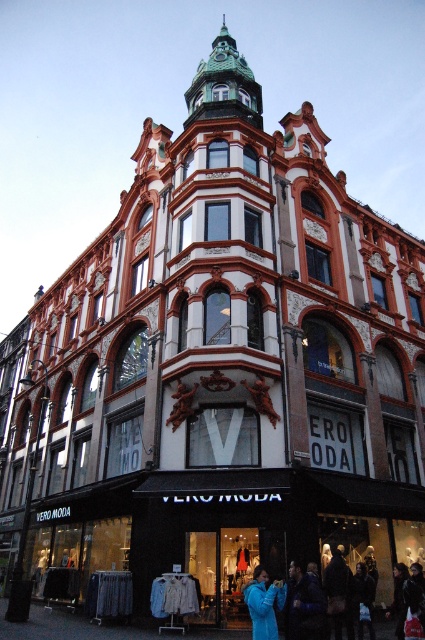
Question: Which point is farther to the camera?

Choices:
 (A) blue fleece jacket at lower center
 (B) dark blue jacket at lower center

Answer: (A)

Question: Which of the following is the closest to the observer?

Choices:
 (A) (272, 616)
 (B) (286, 627)

Answer: (A)

Question: Can you confirm if dark blue jacket at lower center is smaller than blue fleece jacket at lower center?

Choices:
 (A) no
 (B) yes

Answer: (B)

Question: Does dark blue jacket at lower center appear under blue fleece jacket at lower center?

Choices:
 (A) no
 (B) yes

Answer: (A)

Question: Which of the following is the farthest from the observer?

Choices:
 (A) blue fleece jacket at lower center
 (B) dark blue jacket at lower center

Answer: (A)

Question: Does dark blue jacket at lower center come in front of blue fleece jacket at lower center?

Choices:
 (A) no
 (B) yes

Answer: (B)